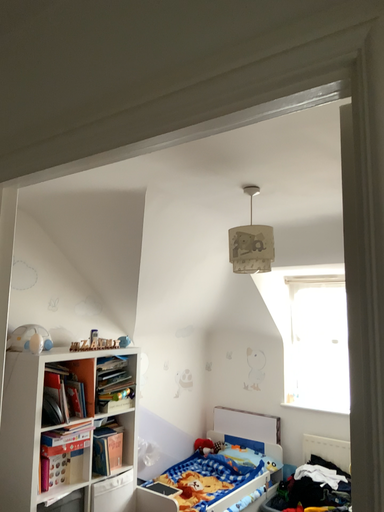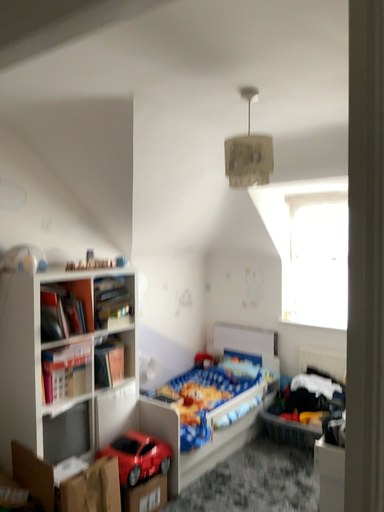
Question: How did the camera likely rotate when shooting the video?

Choices:
 (A) rotated upward
 (B) rotated downward

Answer: (B)